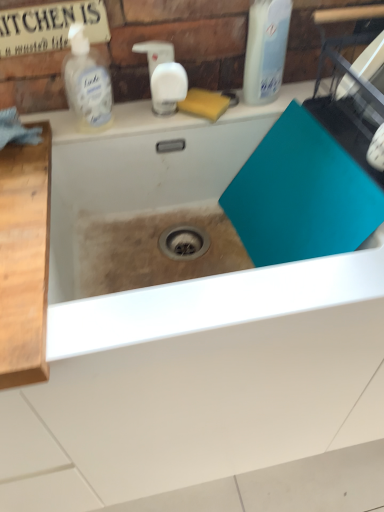
Question: Is teal matte cutting board at center bigger or smaller than clear plastic bottle at upper left, positioned as the first cleaning product in left-to-right order?

Choices:
 (A) small
 (B) big

Answer: (B)

Question: Is teal matte cutting board at center in front of or behind clear plastic bottle at upper left, positioned as the first cleaning product in left-to-right order, in the image?

Choices:
 (A) front
 (B) behind

Answer: (A)

Question: Which of these objects is positioned closest to the clear plastic bottle at upper left, positioned as the first cleaning product in left-to-right order?

Choices:
 (A) translucent plastic bottle at upper right, the second cleaning product from the left
 (B) teal matte cutting board at center

Answer: (B)

Question: Which is nearer to the translucent plastic bottle at upper right, which is the first cleaning product from right to left?

Choices:
 (A) clear plastic bottle at upper left, marked as the second cleaning product in a right-to-left arrangement
 (B) teal matte cutting board at center

Answer: (B)